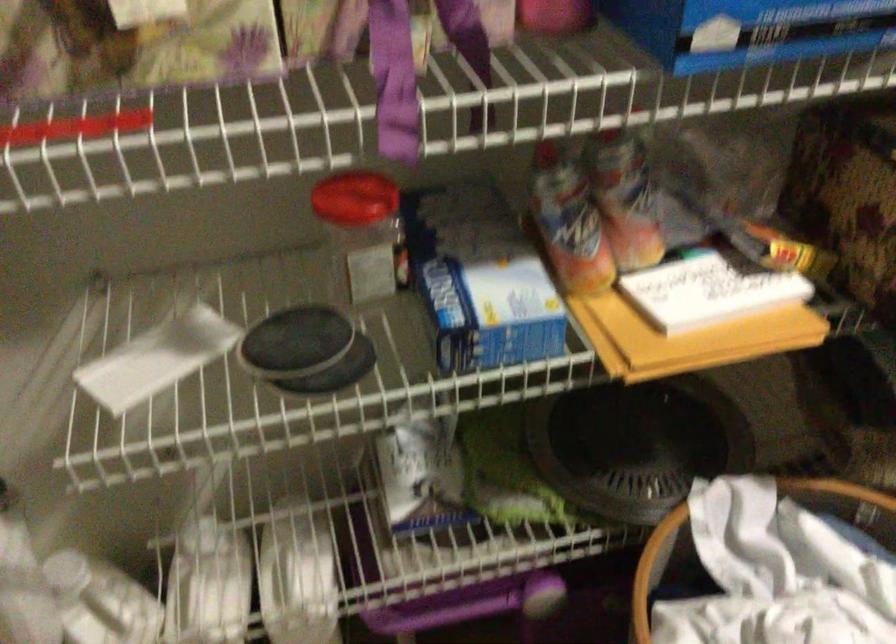
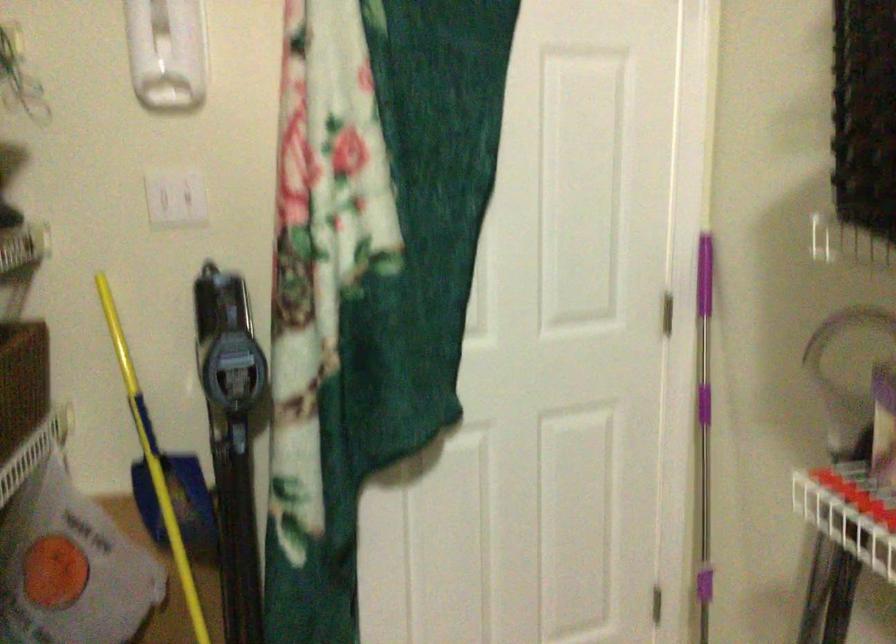
Question: The images are taken continuously from a first-person perspective. In which direction is your viewpoint rotating?

Choices:
 (A) Left
 (B) Right
 (C) Up
 (D) Down

Answer: (A)